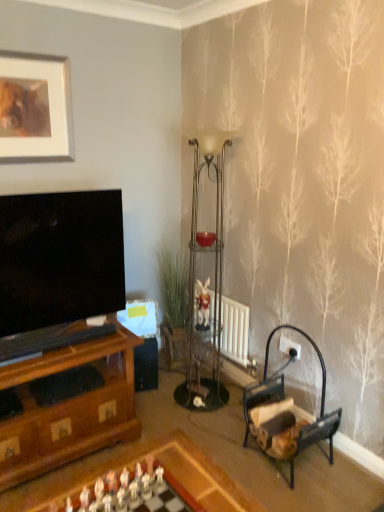
Question: Is matte silver picture frame at upper left thinner than wooden chess set at center?

Choices:
 (A) no
 (B) yes

Answer: (B)

Question: From a real-world perspective, does matte silver picture frame at upper left sit lower than wooden chess set at center?

Choices:
 (A) yes
 (B) no

Answer: (B)

Question: Is matte silver picture frame at upper left positioned far away from wooden chess set at center?

Choices:
 (A) yes
 (B) no

Answer: (A)

Question: Is matte silver picture frame at upper left positioned behind wooden chess set at center?

Choices:
 (A) no
 (B) yes

Answer: (B)

Question: Is the position of matte silver picture frame at upper left less distant than that of wooden chess set at center?

Choices:
 (A) no
 (B) yes

Answer: (A)

Question: Would you say matte silver picture frame at upper left is outside wooden chess set at center?

Choices:
 (A) no
 (B) yes

Answer: (B)

Question: From the image's perspective, is metallic glass side table at center on top of matte glass candle holder at center?

Choices:
 (A) yes
 (B) no

Answer: (B)

Question: Is metallic glass side table at center facing towards matte glass candle holder at center?

Choices:
 (A) yes
 (B) no

Answer: (B)

Question: From a real-world perspective, does metallic glass side table at center stand above matte glass candle holder at center?

Choices:
 (A) no
 (B) yes

Answer: (A)

Question: Is metallic glass side table at center taller than matte glass candle holder at center?

Choices:
 (A) yes
 (B) no

Answer: (A)

Question: Are metallic glass side table at center and matte glass candle holder at center far apart?

Choices:
 (A) no
 (B) yes

Answer: (A)

Question: Is metallic glass side table at center wider than matte glass candle holder at center?

Choices:
 (A) no
 (B) yes

Answer: (A)

Question: Is wooden chessboard at lower center outside wooden armchair at lower right?

Choices:
 (A) no
 (B) yes

Answer: (B)